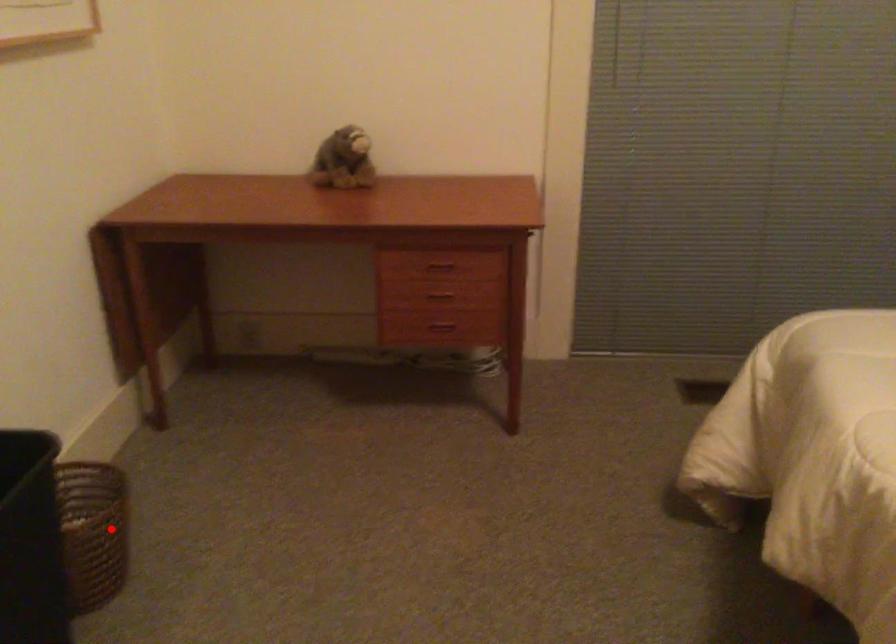
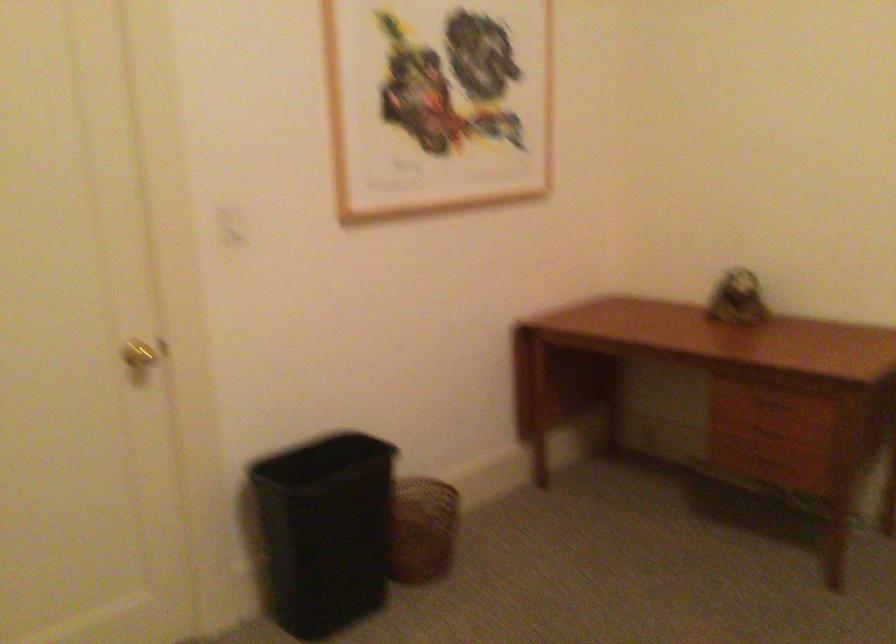
Question: I am providing you with two images of the same scene from different viewpoints. In image1, a red point is highlighted. Considering the same 3D point in image2, which of the following is correct?

Choices:
 (A) It is closer
 (B) It is farther

Answer: (B)